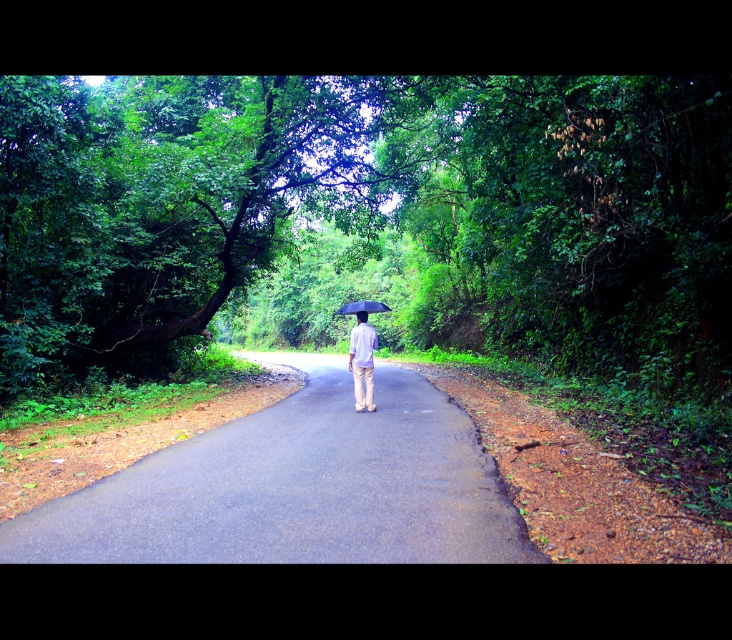
You are a hiker who just started walking on the asphalt road at center. You notice a black matte umbrella at center nearby. Which object is larger in size?

The black matte umbrella at center is larger than the asphalt road at center.

You are a hiker who just entered the forest and see the asphalt road at center and the light purple fabric umbrella at center. Which object is closer to your right side?

The light purple fabric umbrella at center is closer to your right side because the asphalt road at center is to its left.